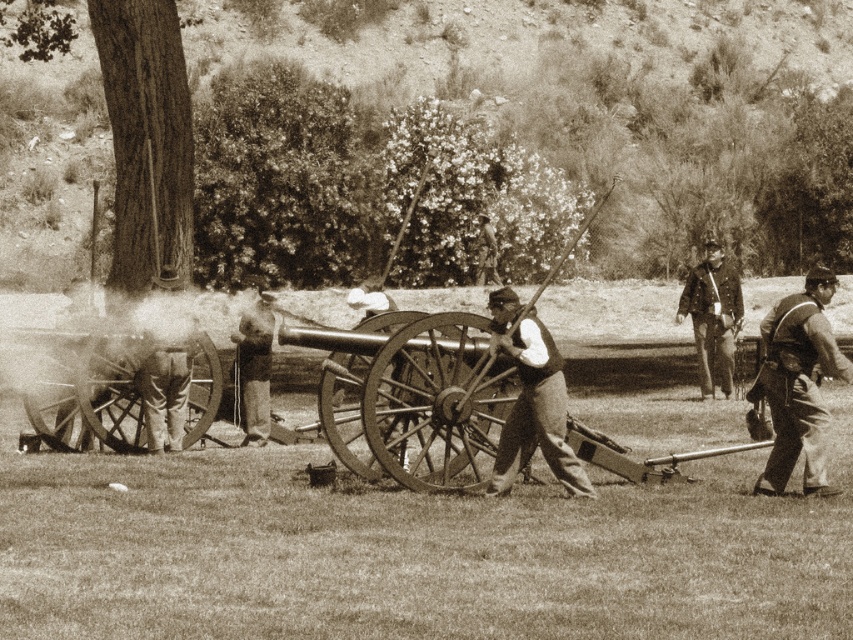
Between smooth leather hat at upper right and smooth leather hat at center, which one has more height?

smooth leather hat at upper right is taller.

Identify the location of smooth leather hat at upper right. (712, 316).

Find the location of a particular element. The height and width of the screenshot is (640, 853). smooth leather hat at upper right is located at coordinates (712, 316).

Can you confirm if rustic leather vest at right is positioned to the left of smooth leather hat at upper right?

No, rustic leather vest at right is not to the left of smooth leather hat at upper right.

Is point (778, 340) closer to viewer compared to point (709, 292)?

Yes, it is.

This screenshot has width=853, height=640. I want to click on rustic leather vest at right, so click(x=798, y=381).

Consider the image. Which is below, matte black vest at center or smooth leather hat at center?

matte black vest at center is lower down.

Between matte black vest at center and smooth leather hat at center, which one has less height?

With less height is matte black vest at center.

Is point (546, 451) in front of point (251, 376)?

Yes, it is.

Locate an element on the screen. The height and width of the screenshot is (640, 853). matte black vest at center is located at coordinates (532, 401).